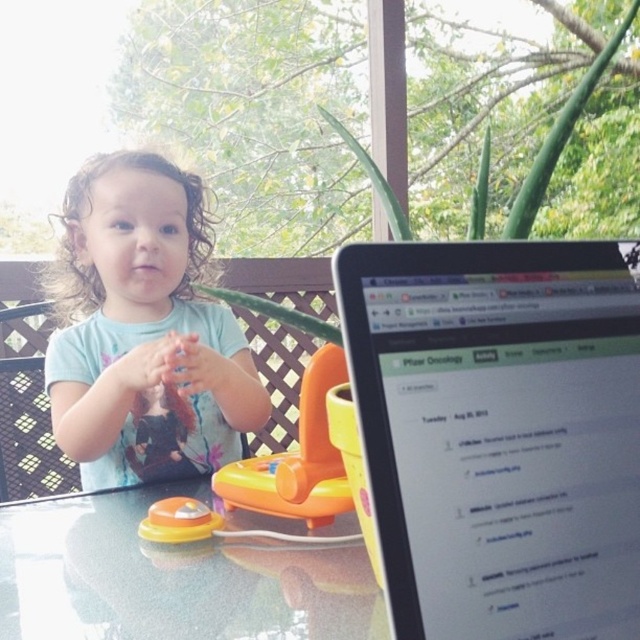
Question: Considering the real-world distances, which object is farthest from the light blue cotton toddler at center?

Choices:
 (A) orange plastic toy at center
 (B) glossy plastic table at center
 (C) translucent orange toy at center

Answer: (C)

Question: Which of the following is the closest to the observer?

Choices:
 (A) (168, 532)
 (B) (179, 472)
 (C) (317, 506)
 (D) (150, 552)

Answer: (C)

Question: Which of the following is the closest to the observer?

Choices:
 (A) orange plastic toy at center
 (B) light blue cotton toddler at center
 (C) glossy plastic table at center

Answer: (C)

Question: Where is matte black laptop at center located in relation to light blue cotton toddler at center in the image?

Choices:
 (A) below
 (B) above

Answer: (A)

Question: Can you confirm if glossy plastic table at center is positioned below translucent orange toy at center?

Choices:
 (A) no
 (B) yes

Answer: (B)

Question: Is matte black laptop at center thinner than glossy plastic table at center?

Choices:
 (A) no
 (B) yes

Answer: (B)